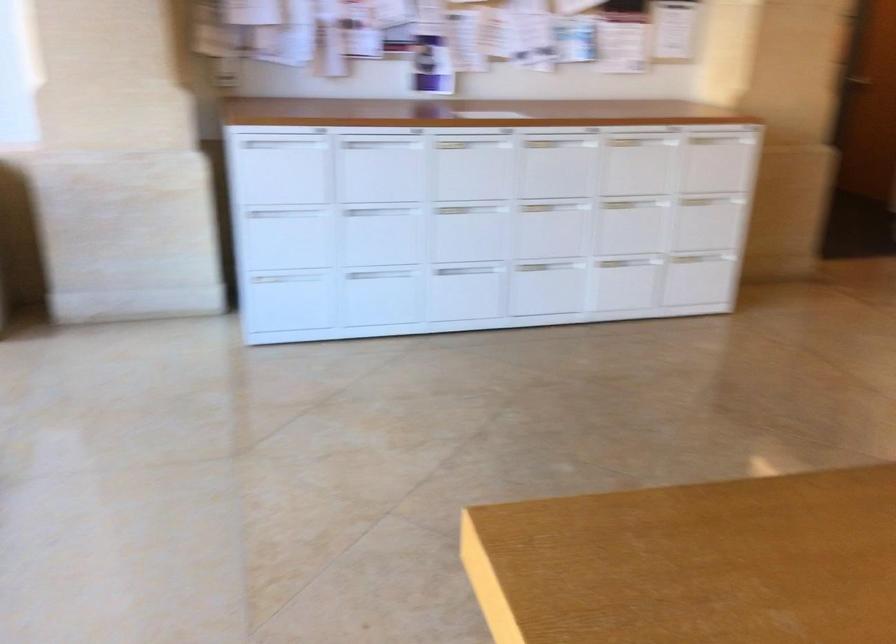
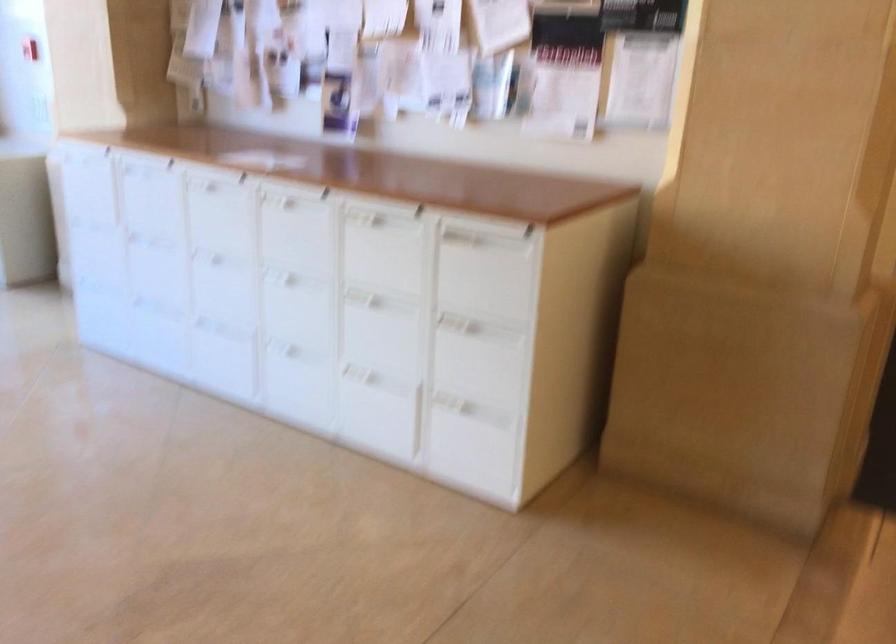
Find the pixel in the second image that matches point 543,158 in the first image.

(295, 228)